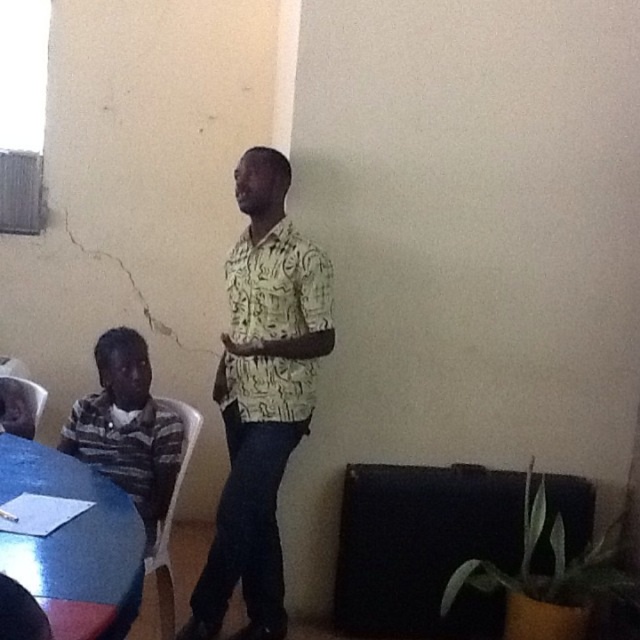
You are organizing a small event and need to place a 12 inch wide decorative plate on either the yellow printed shirt at center or the smooth glossy wood table at lower left. Based on their sizes, which object is more suitable for placing the plate?

The smooth glossy wood table at lower left is more suitable for placing the 12 inch wide decorative plate since it has a greater width than the yellow printed shirt at center.

You are a person who needs to place a 28 inch wide laptop on the table. Can the yellow printed shirt at center and the smooth glossy wood table at lower left accommodate the laptop?

The distance between the yellow printed shirt at center and the smooth glossy wood table at lower left is 30.22 inches. Since the laptop is 28 inches wide, it can fit between them as there is enough space.